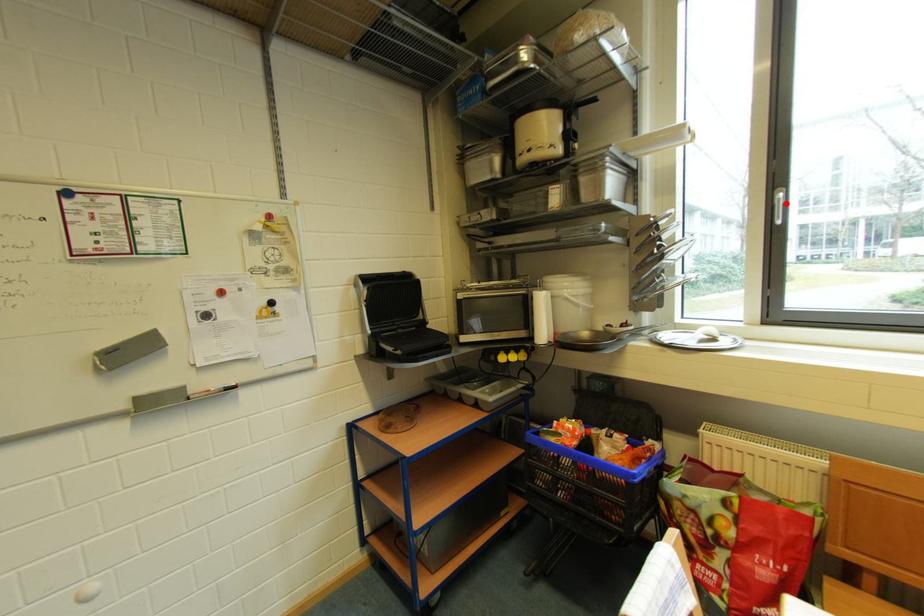
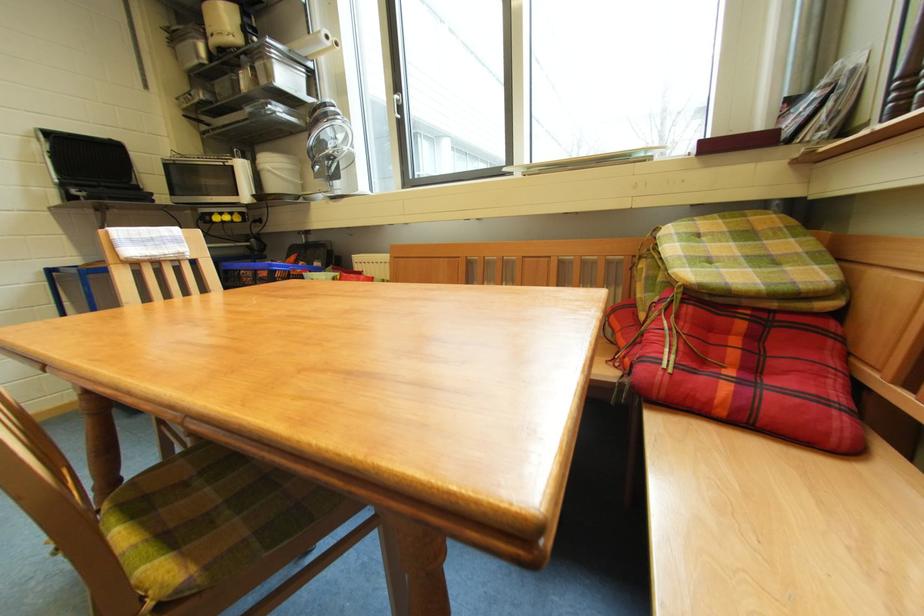
Question: I am providing you with two images of the same scene from different viewpoints. Image1 has a red point marked. In image2, the corresponding 3D location appears at what relative position? Reply with the corresponding letter.

Choices:
 (A) Closer
 (B) Farther

Answer: (A)